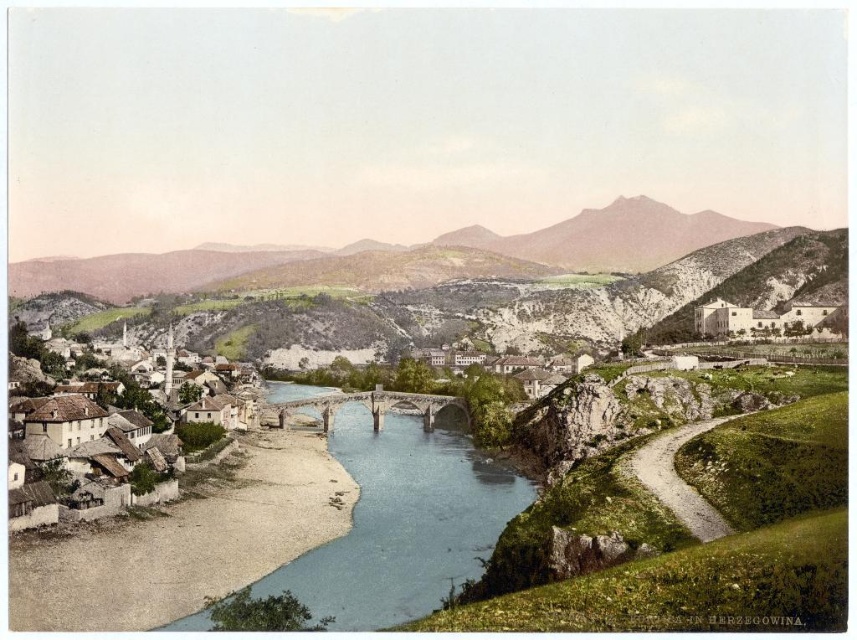
You are a tourist standing at the bridge in the town and want to take a photo that includes both the blue stone river at center and the white stone houses at lower left. Which object should you position closer to the edge of your camera frame to ensure both are fully visible?

Since the blue stone river at center is shorter than the white stone houses at lower left, you should position the white stone houses at lower left closer to the edge of your camera frame to ensure both objects are fully visible in the photo.

You are standing at the top of a hill overlooking the town and the river. You notice the white stone houses at lower left and the rugged stone mountain at center. Which of these two landmarks is closer to your current position?

The rugged stone mountain at center is closer to your current position because the white stone houses at lower left are situated behind it.